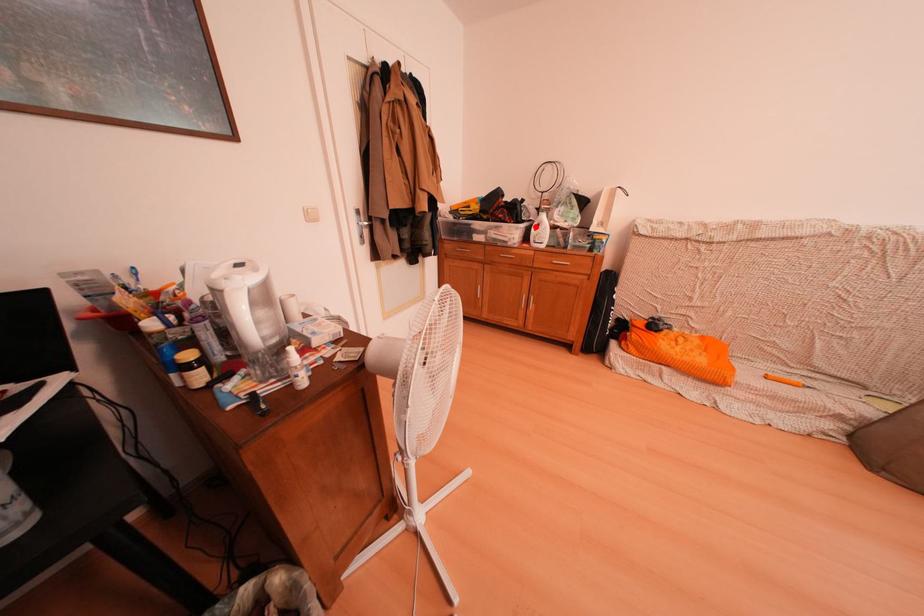
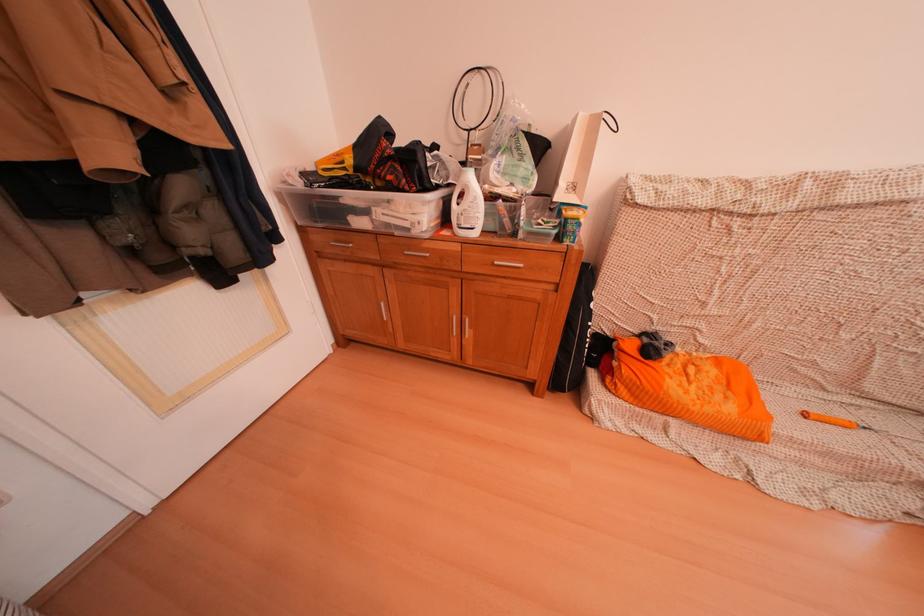
Locate, in the second image, the point that corresponds to the highlighted location in the first image.

(450, 192)